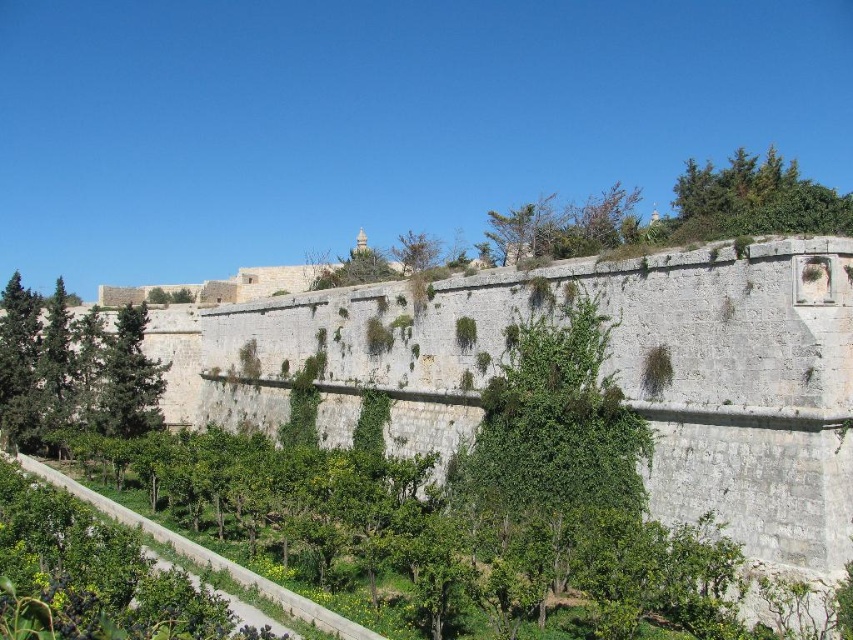
You are standing in front of the historical stone wall and want to plant a new tree in the garden area. The garden area is located in front of the wall. The new tree must be placed exactly at the same position as the green leafy tree at upper left. Where should you plant the new tree?

You should plant the new tree at the position where the green leafy tree at upper left is located, which is at point coordinates (x=73, y=371).

Consider the image. You are standing at point (550, 444) in the image. What object is located at this point?

The green leafy tree at center is located at point (550, 444).